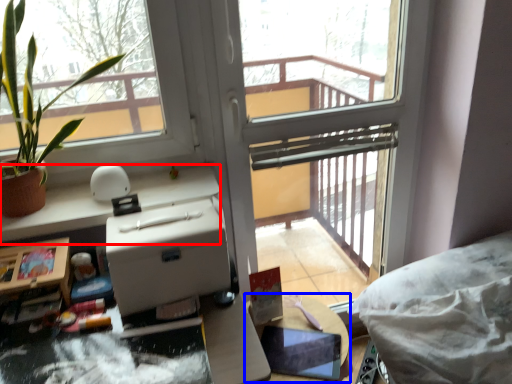
Question: Which point is further to the camera, counter top (highlighted by a red box) or table (highlighted by a blue box)?

Choices:
 (A) counter top
 (B) table

Answer: (B)